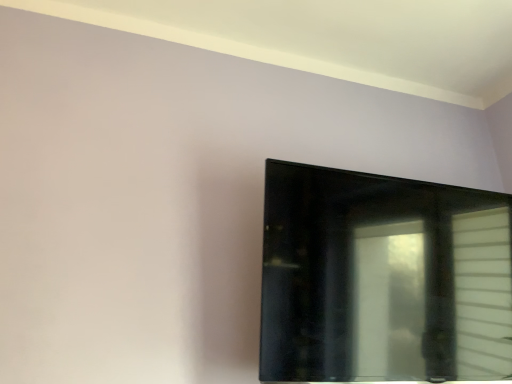
Locate an element on the screen. The image size is (512, 384). transparent glass window at upper right is located at coordinates (383, 279).

What do you see at coordinates (383, 279) in the screenshot?
I see `transparent glass window at upper right` at bounding box center [383, 279].

Find the location of a particular element. This screenshot has height=384, width=512. transparent glass window at upper right is located at coordinates (383, 279).